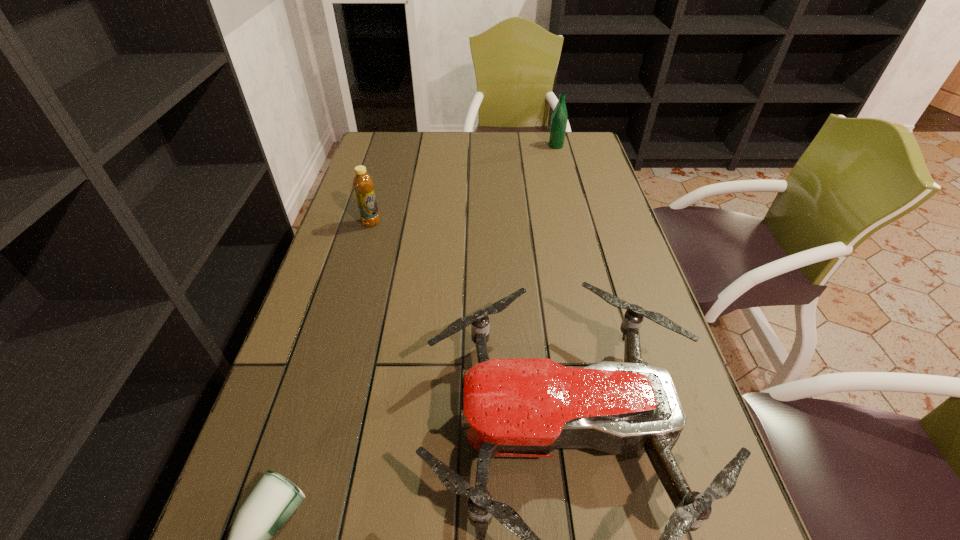
The height and width of the screenshot is (540, 960). What are the coordinates of `vacant space at the left edge` in the screenshot? It's located at (366, 283).

In the image, there is a desktop. In order to click on free space at the right edge in this screenshot , I will do `click(620, 244)`.

The width and height of the screenshot is (960, 540). In order to click on blank space at the far left corner in this screenshot , I will do `click(364, 152)`.

The image size is (960, 540). In the image, there is a desktop. Identify the location of vacant space at the far right corner. (590, 135).

You are a GUI agent. You are given a task and a screenshot of the screen. Output one action in this format:
    pyautogui.click(x=<x>, y=<y>)
    Task: Click on the empty space between the second farthest object and the farthest bottle
    Image resolution: width=960 pixels, height=540 pixels.
    Given the screenshot: What is the action you would take?
    pyautogui.click(x=464, y=184)

Find the location of a particular element. vacant area between the farthest bottle and the second farthest bottle is located at coordinates (464, 184).

Find the location of a particular element. free space between the farthest object and the second farthest bottle is located at coordinates (464, 184).

Locate which object ranks in proximity to the rightmost bottle. Please provide its 2D coordinates. Your answer should be formatted as a tuple, i.e. [(x, y)], where the tuple contains the x and y coordinates of a point satisfying the conditions above.

[(363, 184)]

Choose which object is the third nearest neighbor to the third tallest object. Please provide its 2D coordinates. Your answer should be formatted as a tuple, i.e. [(x, y)], where the tuple contains the x and y coordinates of a point satisfying the conditions above.

[(559, 118)]

This screenshot has width=960, height=540. I want to click on bottle object that ranks as the closest to the shortest object, so point(363,184).